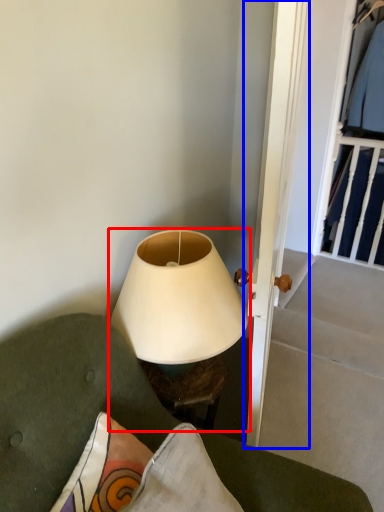
Question: Which object appears closest to the camera in this image, lamp (highlighted by a red box) or door (highlighted by a blue box)?

Choices:
 (A) lamp
 (B) door

Answer: (B)